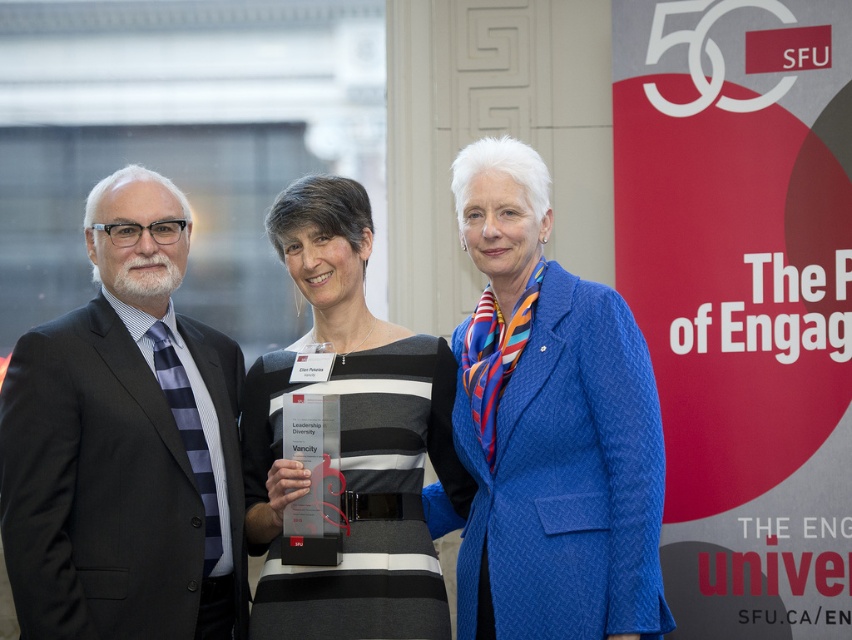
Does point (596, 403) come farther from viewer compared to point (360, 404)?

That is False.

Between point (617, 625) and point (430, 369), which one is positioned in front?

Point (617, 625) is more forward.

Does point (505, 492) come in front of point (344, 301)?

Yes, point (505, 492) is closer to viewer.

The image size is (852, 640). Identify the location of blue textured blazer at center. (548, 429).

Does black suit at left have a larger size compared to blue textured blazer at center?

Correct, black suit at left is larger in size than blue textured blazer at center.

Who is positioned more to the right, black suit at left or blue textured blazer at center?

blue textured blazer at center is more to the right.

In order to click on black suit at left in this screenshot , I will do `click(125, 444)`.

Does black suit at left appear on the left side of striped fabric dress at center?

Yes, black suit at left is to the left of striped fabric dress at center.

The width and height of the screenshot is (852, 640). Describe the element at coordinates (125, 444) in the screenshot. I see `black suit at left` at that location.

At what (x,y) coordinates should I click in order to perform the action: click on black suit at left. Please return your answer as a coordinate pair (x, y). This screenshot has width=852, height=640. Looking at the image, I should click on (125, 444).